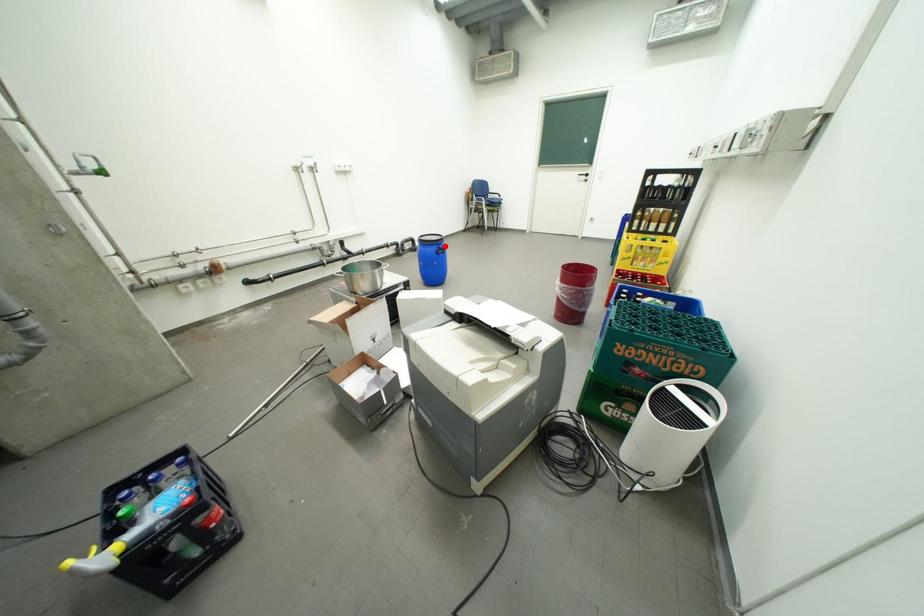
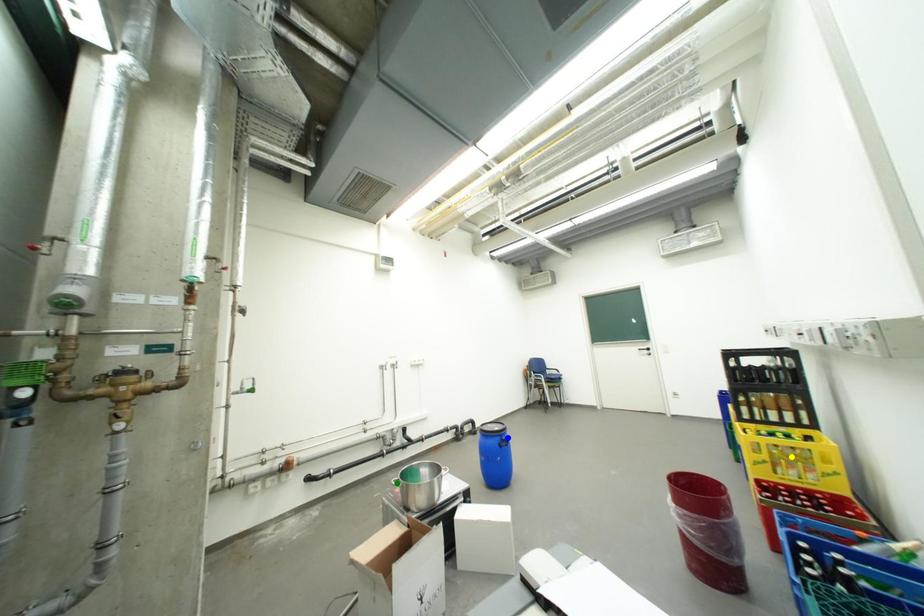
Question: I am providing you with two images of the same scene from different viewpoints. A red point is marked on the first image. You are given multiple points on the second image. Can you choose the point in image 2 that corresponds to the point in image 1?

Choices:
 (A) blue point
 (B) green point
 (C) yellow point

Answer: (A)